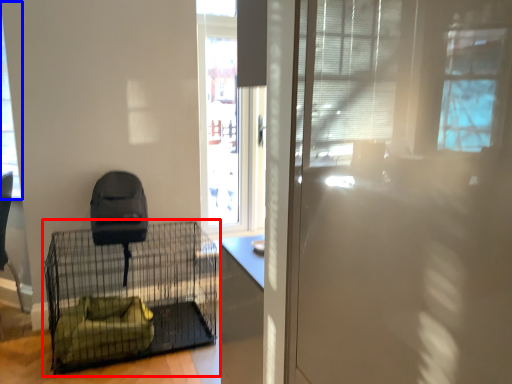
Question: Which point is further to the camera, furniture (highlighted by a red box) or window (highlighted by a blue box)?

Choices:
 (A) furniture
 (B) window

Answer: (B)